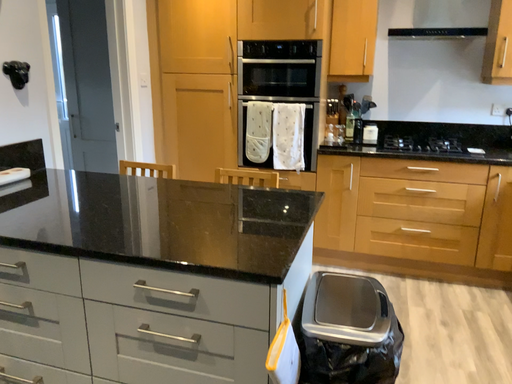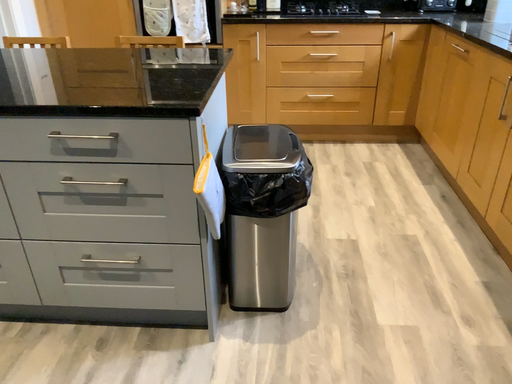
Question: How did the camera likely rotate when shooting the video?

Choices:
 (A) rotated right
 (B) rotated left

Answer: (A)